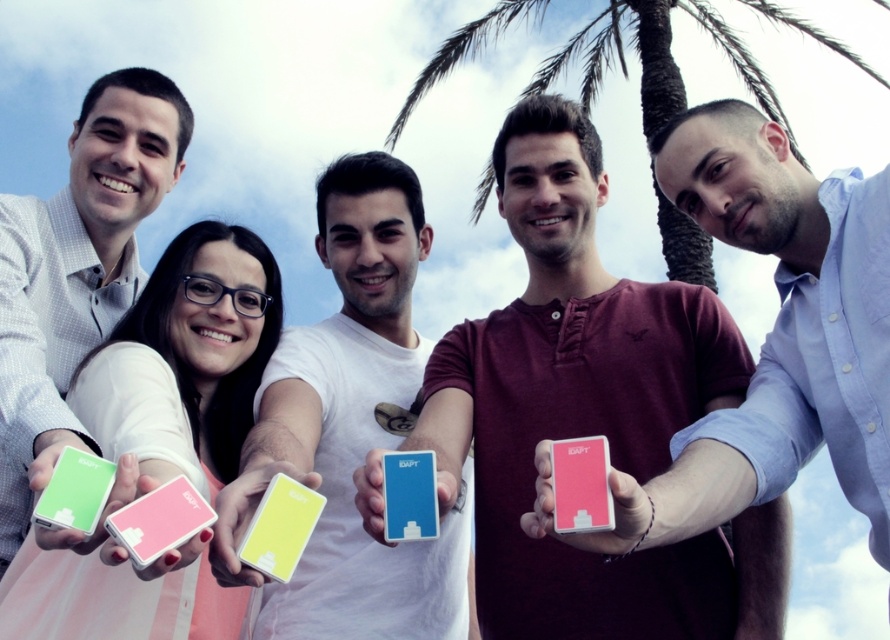
Question: Which object is the closest to the matte white phone at left?

Choices:
 (A) blue matte card at center
 (B) matte plastic phone at center

Answer: (A)

Question: Does matte plastic phone at center appear on the right side of green matte card at left?

Choices:
 (A) yes
 (B) no

Answer: (A)

Question: Is matte plastic card at center below green matte card at left?

Choices:
 (A) no
 (B) yes

Answer: (A)

Question: Which point is closer to the camera taking this photo?

Choices:
 (A) (585, 460)
 (B) (193, 513)

Answer: (B)

Question: Which point is closer to the camera taking this photo?

Choices:
 (A) (150, 497)
 (B) (267, 502)
 (C) (570, 438)

Answer: (A)

Question: Does green matte card at left have a lesser width compared to blue matte card at center?

Choices:
 (A) no
 (B) yes

Answer: (A)